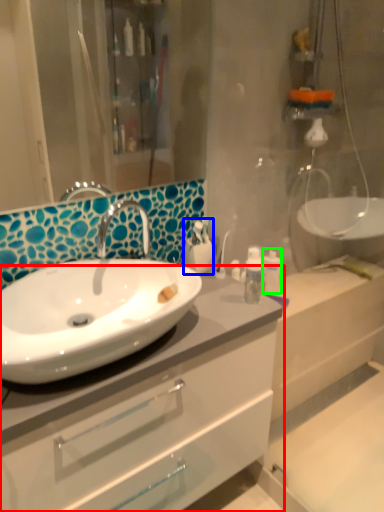
Question: Which object is the farthest from bathroom cabinet (highlighted by a red box)? Choose among these: toiletry (highlighted by a blue box) or toiletry (highlighted by a green box).

Choices:
 (A) toiletry
 (B) toiletry

Answer: (B)